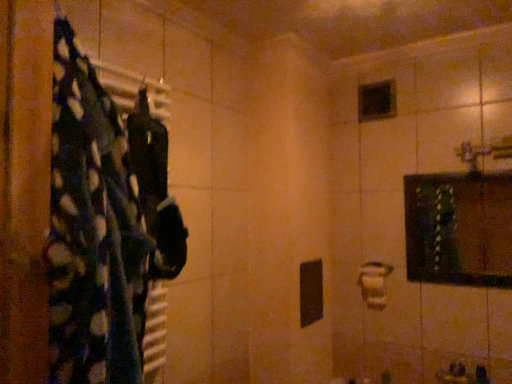
Question: Considering the relative sizes of black glass mirror at upper center and black fabric at left in the image provided, is black glass mirror at upper center smaller than black fabric at left?

Choices:
 (A) no
 (B) yes

Answer: (B)

Question: Is black glass mirror at upper center at the left side of black fabric at left?

Choices:
 (A) no
 (B) yes

Answer: (A)

Question: Does black glass mirror at upper center have a greater width compared to black fabric at left?

Choices:
 (A) no
 (B) yes

Answer: (A)

Question: Is black glass mirror at upper center positioned beyond the bounds of black fabric at left?

Choices:
 (A) no
 (B) yes

Answer: (B)

Question: From a real-world perspective, is black glass mirror at upper center over black fabric at left?

Choices:
 (A) no
 (B) yes

Answer: (B)

Question: Is wooden framed mirror at upper right taller or shorter than black fabric at left?

Choices:
 (A) short
 (B) tall

Answer: (A)

Question: Looking at the image, does wooden framed mirror at upper right seem bigger or smaller compared to black fabric at left?

Choices:
 (A) small
 (B) big

Answer: (A)

Question: Is wooden framed mirror at upper right to the left or to the right of black fabric at left in the image?

Choices:
 (A) right
 (B) left

Answer: (A)

Question: Is point (459, 192) closer or farther from the camera than point (138, 165)?

Choices:
 (A) closer
 (B) farther

Answer: (B)

Question: From the image's perspective, is black glass mirror at upper center positioned above or below white matte toilet paper at center-right?

Choices:
 (A) below
 (B) above

Answer: (B)

Question: Do you think black glass mirror at upper center is within white matte toilet paper at center-right, or outside of it?

Choices:
 (A) outside
 (B) inside

Answer: (A)

Question: Visually, is black glass mirror at upper center positioned to the left or to the right of white matte toilet paper at center-right?

Choices:
 (A) right
 (B) left

Answer: (A)

Question: Does point (371, 97) appear closer or farther from the camera than point (376, 291)?

Choices:
 (A) farther
 (B) closer

Answer: (A)

Question: Looking at their shapes, would you say dark green fabric at left is wider or thinner than wooden framed mirror at upper right?

Choices:
 (A) wide
 (B) thin

Answer: (A)

Question: From a real-world perspective, relative to wooden framed mirror at upper right, is dark green fabric at left vertically above or below?

Choices:
 (A) below
 (B) above

Answer: (B)